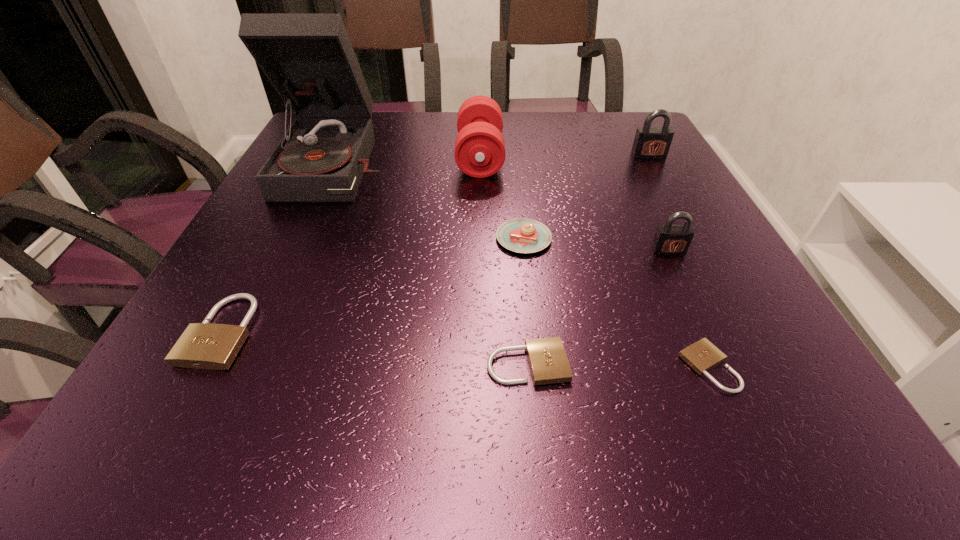
Where is `vacant space located 0.210m on the back of the rightmost beige padlock`? The height and width of the screenshot is (540, 960). vacant space located 0.210m on the back of the rightmost beige padlock is located at coordinates (659, 255).

Image resolution: width=960 pixels, height=540 pixels. In order to click on phonograph_record that is at the far edge in this screenshot , I will do `click(308, 58)`.

Identify the location of padlock at the far edge. The width and height of the screenshot is (960, 540). (650, 142).

You are a GUI agent. You are given a task and a screenshot of the screen. Output one action in this format:
    pyautogui.click(x=<x>, y=<y>)
    Task: Click on the dumbbell located in the far edge section of the desktop
    This screenshot has width=960, height=540.
    Given the screenshot: What is the action you would take?
    pyautogui.click(x=479, y=152)

Identify the location of object that is at the near edge. This screenshot has height=540, width=960. (702, 356).

You are a GUI agent. You are given a task and a screenshot of the screen. Output one action in this format:
    pyautogui.click(x=<x>, y=<y>)
    Task: Click on the phonograph_record that is at the left edge
    The height and width of the screenshot is (540, 960).
    Given the screenshot: What is the action you would take?
    pyautogui.click(x=308, y=58)

At what (x,y) coordinates should I click in order to perform the action: click on padlock present at the left edge. Please return your answer as a coordinate pair (x, y). This screenshot has width=960, height=540. Looking at the image, I should click on (205, 345).

Identify the location of object that is positioned at the far left corner. (308, 58).

Locate an element on the screen. object located in the far right corner section of the desktop is located at coordinates (650, 142).

Locate an element on the screen. The image size is (960, 540). object located at the near right corner is located at coordinates (702, 356).